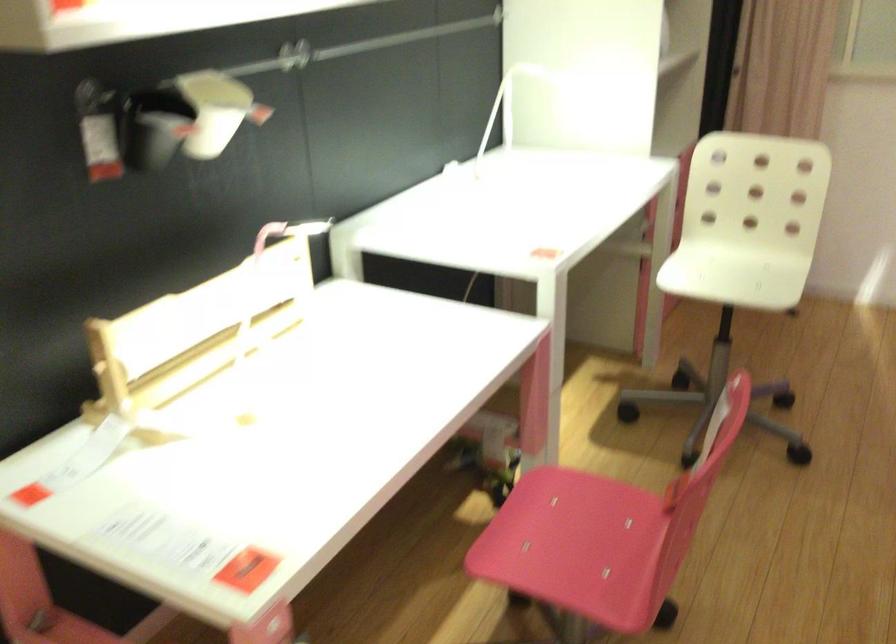
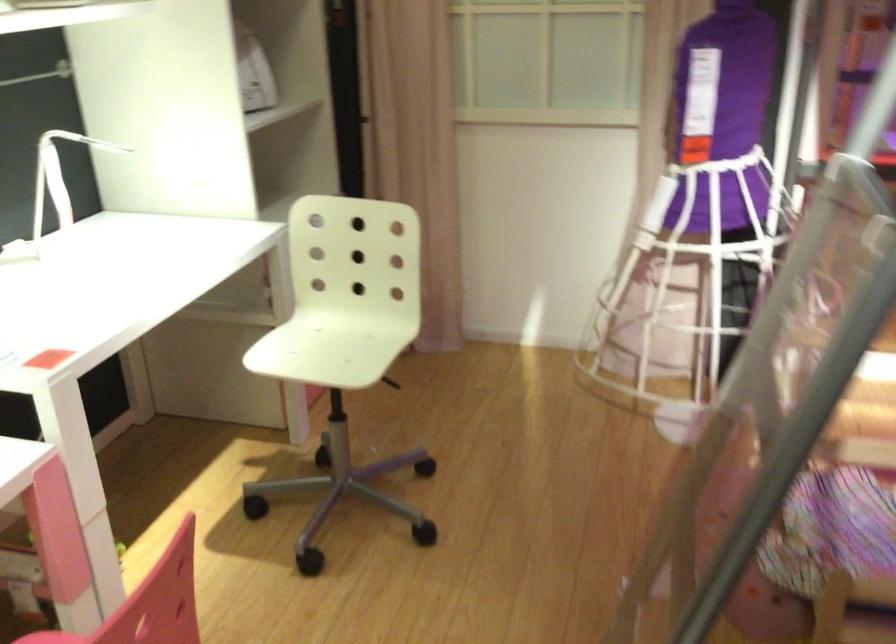
Find the pixel in the second image that matches [736,274] in the first image.

(331, 345)